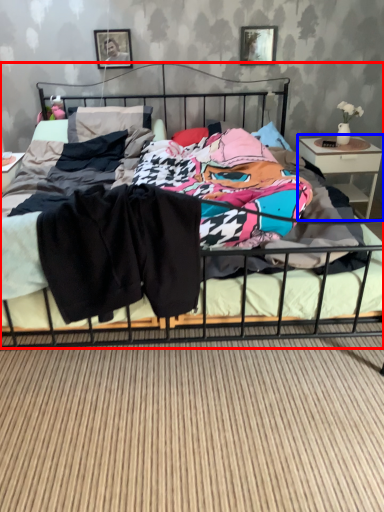
Question: Which object appears closest to the camera in this image, bed (highlighted by a red box) or nightstand (highlighted by a blue box)?

Choices:
 (A) bed
 (B) nightstand

Answer: (A)